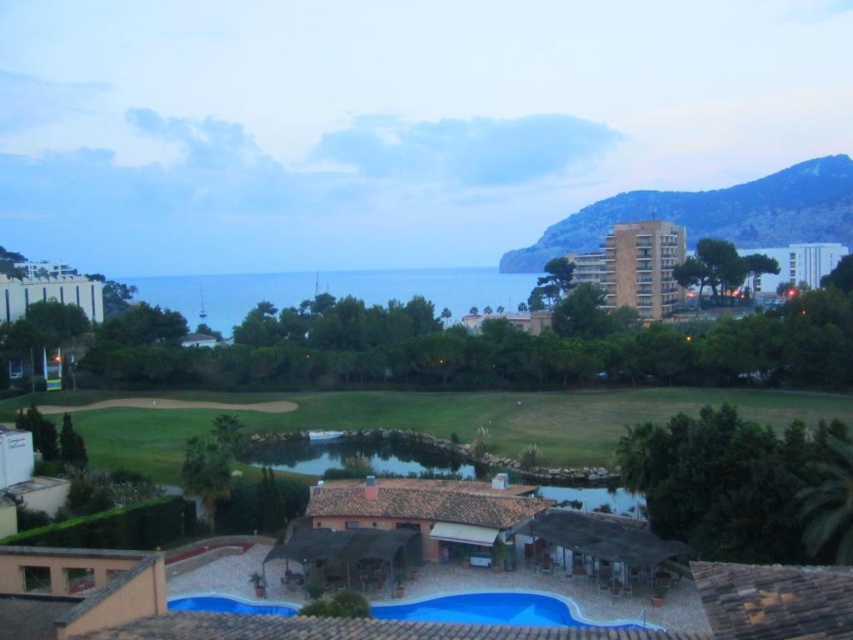
You are a golfer planning to place a new flag on the golf course. You need to ensure it is visible from both the beige concrete building at upper right and the white glossy building at left. Considering their sizes, which building might offer a better vantage point for visibility?

The beige concrete building at upper right has a larger size compared to the white glossy building at left, so it likely offers a better vantage point for visibility due to its size providing a higher elevation or broader view.